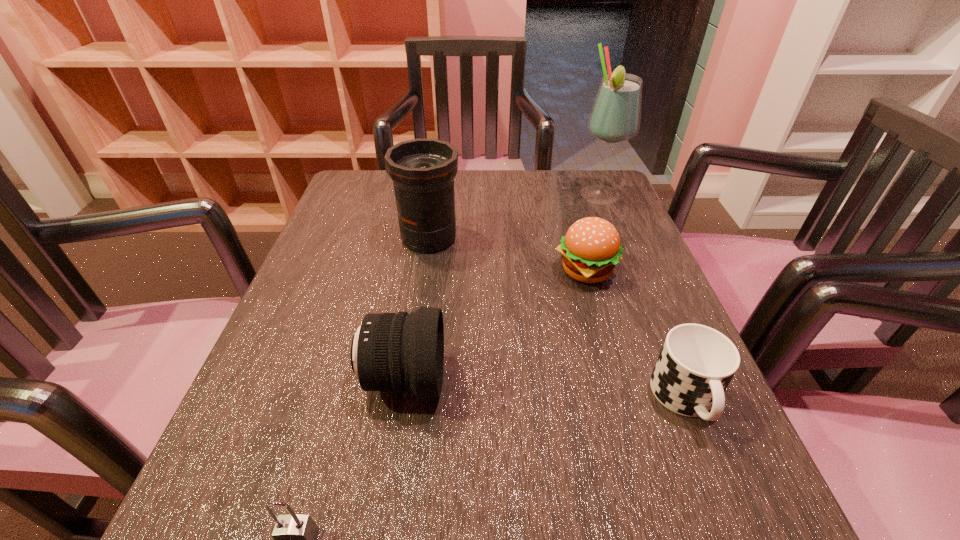
Where is `free space between the hamburger and the shorter telephoto lens`? This screenshot has height=540, width=960. free space between the hamburger and the shorter telephoto lens is located at coordinates (494, 326).

In order to click on free space between the hamburger and the farther telephoto lens in this screenshot , I will do `click(508, 255)`.

In order to click on vacant area that lies between the farther telephoto lens and the shorter telephoto lens in this screenshot , I will do `click(417, 308)`.

This screenshot has height=540, width=960. I want to click on free space between the shorter telephoto lens and the taller telephoto lens, so click(417, 308).

Image resolution: width=960 pixels, height=540 pixels. I want to click on free spot between the cup and the taller telephoto lens, so click(558, 319).

Locate an element on the screen. empty space between the hamburger and the shorter telephoto lens is located at coordinates (494, 326).

The image size is (960, 540). I want to click on object that is the fourth closest to the cup, so point(615,117).

Identify which object is located as the second nearest to the cup. Please provide its 2D coordinates. Your answer should be formatted as a tuple, i.e. [(x, y)], where the tuple contains the x and y coordinates of a point satisfying the conditions above.

[(389, 351)]

You are a GUI agent. You are given a task and a screenshot of the screen. Output one action in this format:
    pyautogui.click(x=<x>, y=<y>)
    Task: Click on the vacant space that satisfies the following two spatial constraints: 1. on the back side of the alcohol; 2. on the left side of the hamburger
    This screenshot has width=960, height=540.
    Given the screenshot: What is the action you would take?
    pyautogui.click(x=564, y=195)